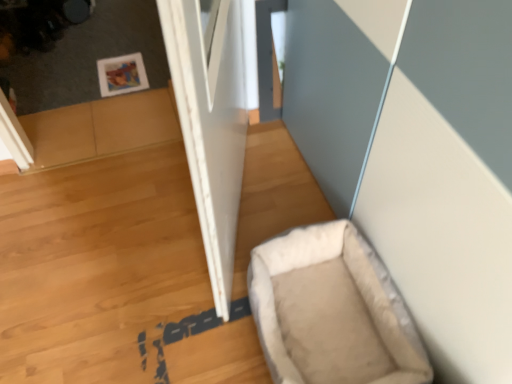
Identify the location of white matte door at center. Image resolution: width=512 pixels, height=384 pixels. (211, 121).

What do you see at coordinates (211, 121) in the screenshot?
I see `white matte door at center` at bounding box center [211, 121].

Measure the distance between point (x=353, y=232) and camera.

4.10 feet.

What do you see at coordinates (331, 310) in the screenshot?
I see `beige fabric dog bed at lower right` at bounding box center [331, 310].

At what (x,y) coordinates should I click in order to perform the action: click on beige fabric dog bed at lower right. Please return your answer as a coordinate pair (x, y). This screenshot has width=512, height=384. Looking at the image, I should click on (331, 310).

Find the location of a particular element. white matte door at center is located at coordinates (211, 121).

Which object is positioned more to the left, beige fabric dog bed at lower right or white matte door at center?

From the viewer's perspective, white matte door at center appears more on the left side.

Is beige fabric dog bed at lower right positioned in front of white matte door at center?

No.

Is point (324, 259) closer or farther from the camera than point (179, 98)?

Clearly, point (324, 259) is more distant from the camera than point (179, 98).

From the image's perspective, which one is positioned higher, beige fabric dog bed at lower right or white matte door at center?

From the image's view, white matte door at center is above.

Consider the image. From a real-world perspective, is beige fabric dog bed at lower right located beneath white matte door at center?

Yes, from a real-world perspective, beige fabric dog bed at lower right is below white matte door at center.

Is beige fabric dog bed at lower right thinner than white matte door at center?

No, beige fabric dog bed at lower right is not thinner than white matte door at center.

Considering the sizes of objects beige fabric dog bed at lower right and white matte door at center in the image provided, who is shorter, beige fabric dog bed at lower right or white matte door at center?

Standing shorter between the two is beige fabric dog bed at lower right.

Considering the sizes of beige fabric dog bed at lower right and white matte door at center in the image, is beige fabric dog bed at lower right bigger or smaller than white matte door at center?

In the image, beige fabric dog bed at lower right appears to be smaller than white matte door at center.

Would you say beige fabric dog bed at lower right is outside white matte door at center?

Yes.

Does beige fabric dog bed at lower right touch white matte door at center?

There is a gap between beige fabric dog bed at lower right and white matte door at center.

Does beige fabric dog bed at lower right turn towards white matte door at center?

No.

Can you tell me how much beige fabric dog bed at lower right and white matte door at center differ in facing direction?

beige fabric dog bed at lower right and white matte door at center are facing 20 degrees away from each other.

The height and width of the screenshot is (384, 512). In the image, there is a white matte door at center. Find the location of `dog bed below it (from the image's perspective)`. dog bed below it (from the image's perspective) is located at coordinates (331, 310).

Between white matte door at center and beige fabric dog bed at lower right, which one appears on the left side from the viewer's perspective?

white matte door at center.

Who is more distant, white matte door at center or beige fabric dog bed at lower right?

beige fabric dog bed at lower right is further away from the camera.

Between point (199, 135) and point (300, 312), which one is positioned in front?

The point (199, 135) is in front.

From the image's perspective, which one is positioned lower, white matte door at center or beige fabric dog bed at lower right?

From the image's view, beige fabric dog bed at lower right is below.

From a real-world perspective, which is physically below, white matte door at center or beige fabric dog bed at lower right?

beige fabric dog bed at lower right is physically lower.

Is white matte door at center wider or thinner than beige fabric dog bed at lower right?

In the image, white matte door at center appears to be more narrow than beige fabric dog bed at lower right.

Based on the photo, does white matte door at center have a lesser height compared to beige fabric dog bed at lower right?

Incorrect, the height of white matte door at center does not fall short of that of beige fabric dog bed at lower right.

Between white matte door at center and beige fabric dog bed at lower right, which one has larger size?

white matte door at center.

Which is correct: white matte door at center is inside beige fabric dog bed at lower right, or outside of it?

white matte door at center is outside beige fabric dog bed at lower right.

Is there a large distance between white matte door at center and beige fabric dog bed at lower right?

No, white matte door at center is not far away from beige fabric dog bed at lower right.

Is white matte door at center facing away from beige fabric dog bed at lower right?

Yes, white matte door at center's orientation is away from beige fabric dog bed at lower right.

How far apart are white matte door at center and beige fabric dog bed at lower right?

white matte door at center and beige fabric dog bed at lower right are 13.35 inches apart from each other.

Locate an element on the screen. door above the beige fabric dog bed at lower right (from the image's perspective) is located at coordinates (211, 121).

Locate an element on the screen. dog bed that is under the white matte door at center (from a real-world perspective) is located at coordinates (331, 310).

The image size is (512, 384). Identify the location of dog bed behind the white matte door at center. (331, 310).